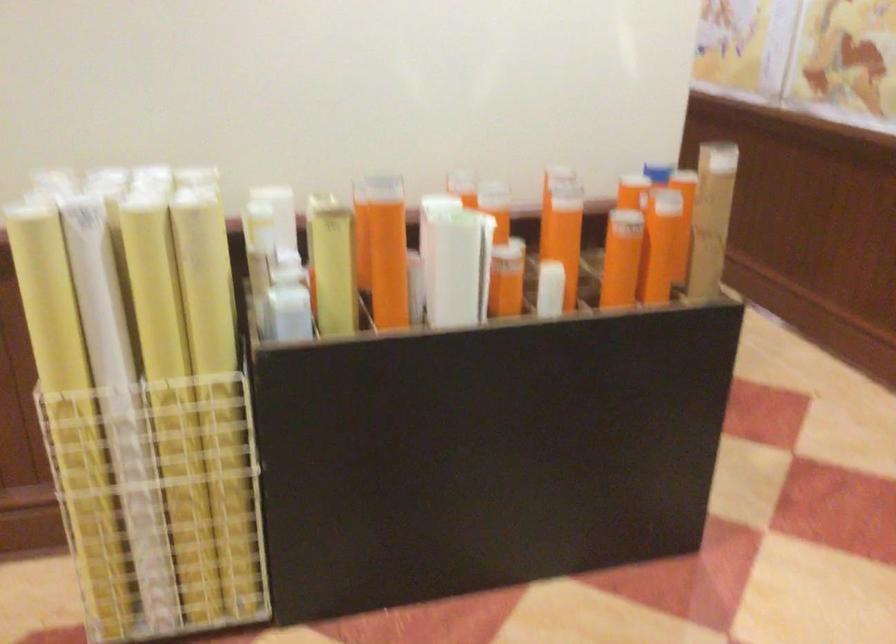
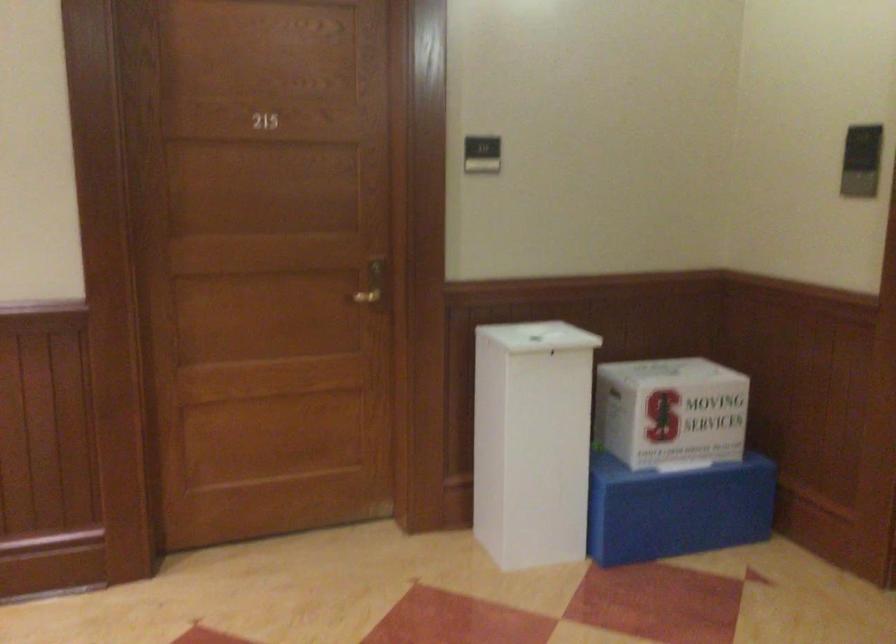
Question: The first image is from the beginning of the video and the second image is from the end. How did the camera likely rotate when shooting the video?

Choices:
 (A) Left
 (B) Right
 (C) Up
 (D) Down

Answer: (B)